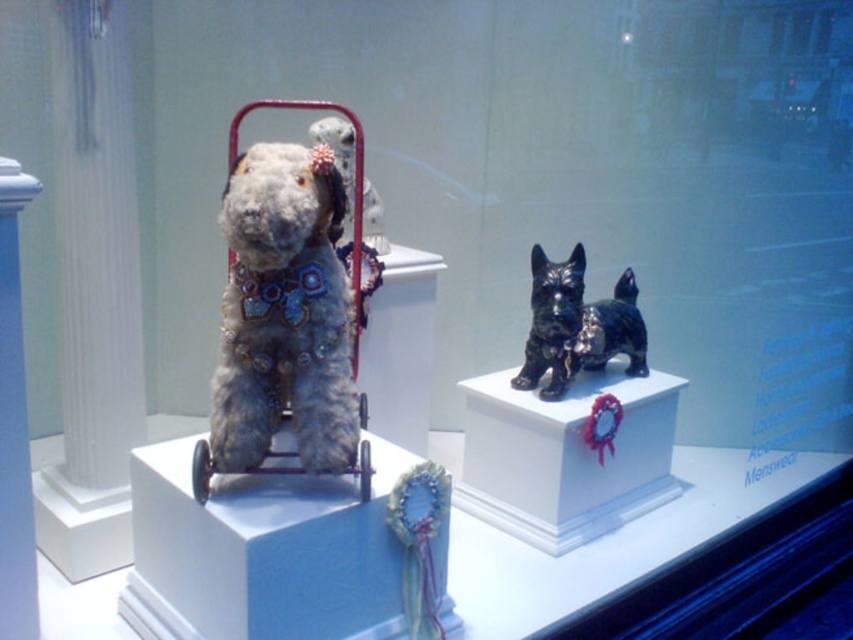
You are a customer in a pet store looking at the display window. You notice the shiny blue ribbon at center and the fuzzy fabric dog stroller at upper center. Which item is closer to you?

The shiny blue ribbon at center is closer to you because it is further to the viewer than the fuzzy fabric dog stroller at upper center.